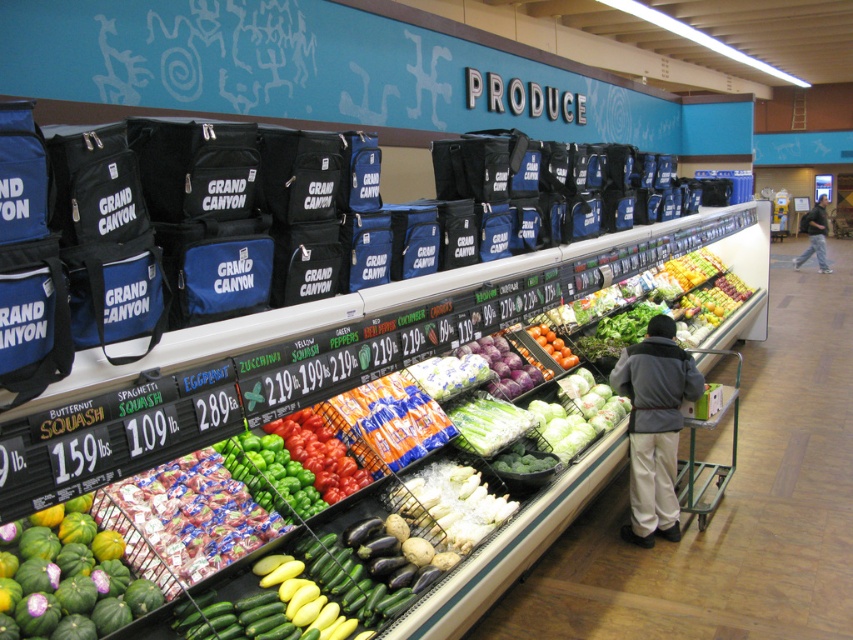
Question: Which point appears farthest from the camera in this image?

Choices:
 (A) (724, 477)
 (B) (67, 632)
 (C) (543, 348)

Answer: (A)

Question: Where is green plastic produce at center located in relation to green matte bell peppers at center in the image?

Choices:
 (A) above
 (B) below

Answer: (A)

Question: Considering the relative positions of green matte bell peppers at center and shiny red tomatoes at center in the image provided, where is green matte bell peppers at center located with respect to shiny red tomatoes at center?

Choices:
 (A) above
 (B) below

Answer: (B)

Question: Which object appears closest to the camera in this image?

Choices:
 (A) green matte squash at lower left
 (B) gray fleece jacket at center
 (C) green metal cart at lower right
 (D) shiny red tomatoes at center

Answer: (A)

Question: Among these points, which one is nearest to the camera?

Choices:
 (A) (329, 442)
 (B) (735, 428)
 (C) (808, 216)

Answer: (A)

Question: Can you confirm if green plastic produce at center is positioned to the right of shiny red tomatoes at center?

Choices:
 (A) no
 (B) yes

Answer: (B)